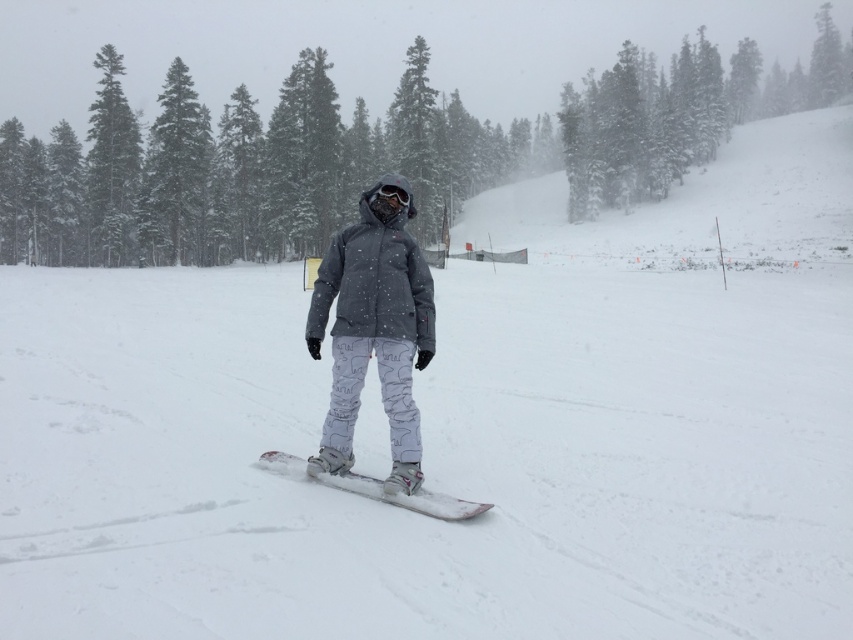
Question: Can you confirm if white matte snowboard at center is bigger than matte black goggles at center?

Choices:
 (A) no
 (B) yes

Answer: (B)

Question: Which of the following is the closest to the observer?

Choices:
 (A) gray matte jacket at center
 (B) white matte snowboard at center
 (C) green matte tree at center
 (D) matte black goggles at center

Answer: (B)

Question: Which of the following is the farthest from the observer?

Choices:
 (A) (358, 342)
 (B) (357, 481)

Answer: (B)

Question: Is gray matte jacket at center to the left of matte black goggles at center from the viewer's perspective?

Choices:
 (A) yes
 (B) no

Answer: (A)

Question: Which object is the farthest from the white matte snowboard at center?

Choices:
 (A) green matte tree at center
 (B) gray matte jacket at center
 (C) matte black goggles at center

Answer: (A)

Question: Can you confirm if green matte tree at center is wider than gray matte jacket at center?

Choices:
 (A) yes
 (B) no

Answer: (A)